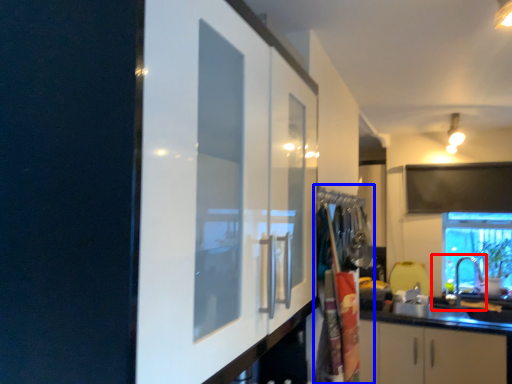
Question: Which object is further to the camera taking this photo, sink (highlighted by a red box) or laundry (highlighted by a blue box)?

Choices:
 (A) sink
 (B) laundry

Answer: (A)